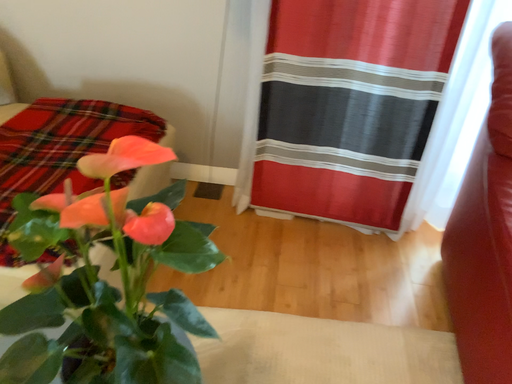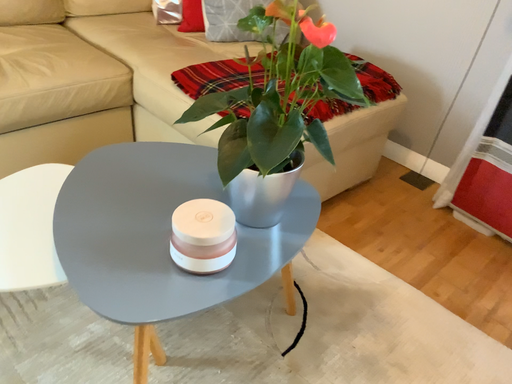
Question: How did the camera likely rotate when shooting the video?

Choices:
 (A) rotated right
 (B) rotated left

Answer: (B)